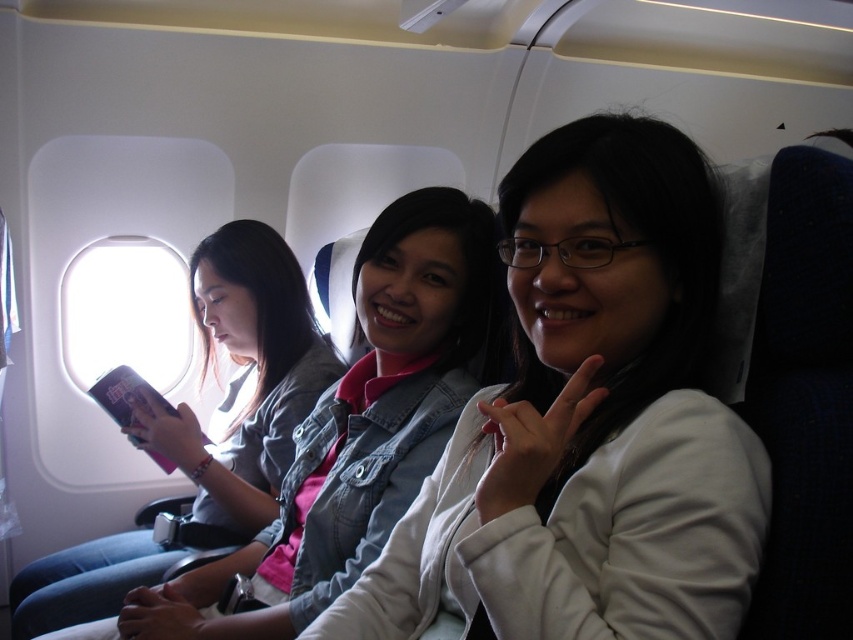
Question: Among these objects, which one is nearest to the camera?

Choices:
 (A) transparent glass airplane window at upper left
 (B) white matte jacket at center
 (C) denim jacket at center

Answer: (B)

Question: Is denim jacket at center bigger than transparent glass airplane window at upper left?

Choices:
 (A) no
 (B) yes

Answer: (B)

Question: Which of the following is the farthest from the observer?

Choices:
 (A) transparent glass airplane window at upper left
 (B) white matte jacket at center
 (C) denim jacket at center

Answer: (A)

Question: Is white matte jacket at center below transparent glass airplane window at upper left?

Choices:
 (A) yes
 (B) no

Answer: (A)

Question: Estimate the real-world distances between objects in this image. Which object is closer to the denim jacket at center?

Choices:
 (A) transparent glass airplane window at upper left
 (B) white matte jacket at center

Answer: (B)

Question: Is white matte jacket at center positioned before transparent glass airplane window at upper left?

Choices:
 (A) yes
 (B) no

Answer: (A)